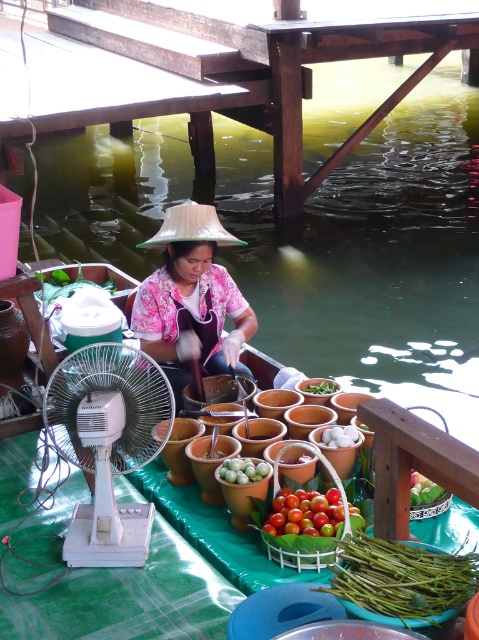
Between green matte eggplant at center and green matte fruit at center, which one has more height?

green matte fruit at center

Who is more distant from viewer, (x=232, y=481) or (x=429, y=481)?

Positioned behind is point (x=429, y=481).

Measure the distance between point (236, 474) and camera.

12.96 feet

Identify the location of green matte eggplant at center. (242, 470).

Can you confirm if white plastic mechanical fan at left is shorter than ripe glossy tomatoes at center?

No.

Which is above, white plastic mechanical fan at left or ripe glossy tomatoes at center?

white plastic mechanical fan at left is above.

Is point (89, 442) positioned before point (334, 532)?

Yes.

You are a GUI agent. You are given a task and a screenshot of the screen. Output one action in this format:
    pyautogui.click(x=<x>, y=<y>)
    Task: Click on the white plastic mechanical fan at left
    
    Given the screenshot: What is the action you would take?
    pyautogui.click(x=107, y=444)

Can you confirm if wooden dock at center is taller than ripe glossy tomatoes at center?

Indeed, wooden dock at center has a greater height compared to ripe glossy tomatoes at center.

Can you confirm if wooden dock at center is positioned above ripe glossy tomatoes at center?

Correct, wooden dock at center is located above ripe glossy tomatoes at center.

Is point (161, 28) positioned behind point (339, 500)?

Yes, it is.

Locate an element on the screen. The height and width of the screenshot is (640, 479). wooden dock at center is located at coordinates (234, 68).